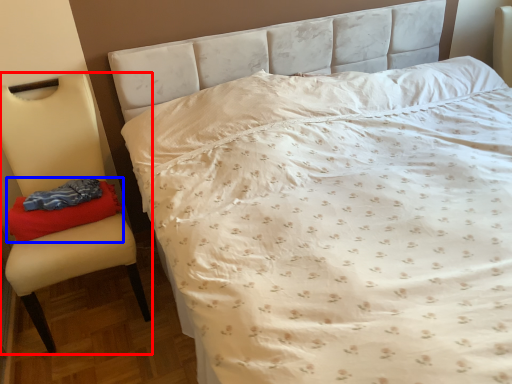
Question: Which object is closer to the camera taking this photo, chair (highlighted by a red box) or material (highlighted by a blue box)?

Choices:
 (A) chair
 (B) material

Answer: (A)